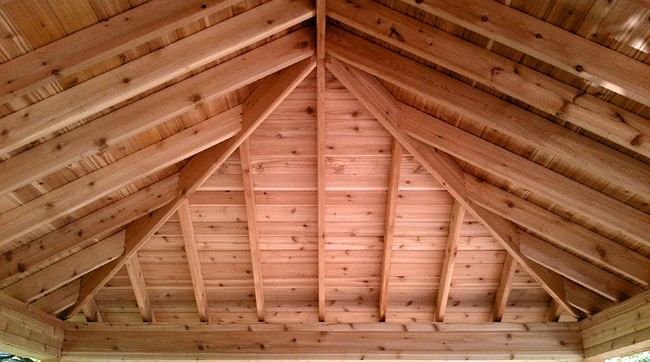
I want to click on ceiling, so click(x=358, y=181).